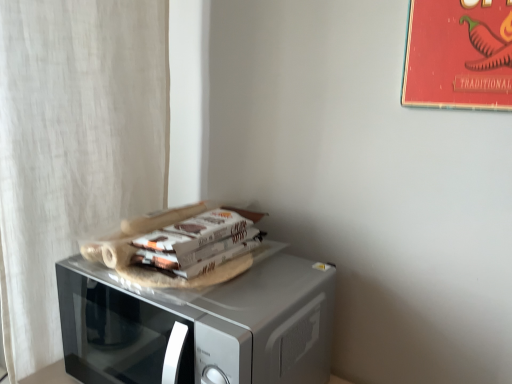
Question: Is point (509, 87) positioned closer to the camera than point (32, 87)?

Choices:
 (A) closer
 (B) farther

Answer: (A)

Question: Is red paper poster at upper right bigger or smaller than white textured curtain at left?

Choices:
 (A) big
 (B) small

Answer: (B)

Question: Based on their relative distances, which object is nearer to the white textured curtain at left?

Choices:
 (A) silver metallic microwave at center
 (B) red paper poster at upper right

Answer: (A)

Question: Which object is positioned farthest from the white textured curtain at left?

Choices:
 (A) red paper poster at upper right
 (B) silver metallic microwave at center

Answer: (A)